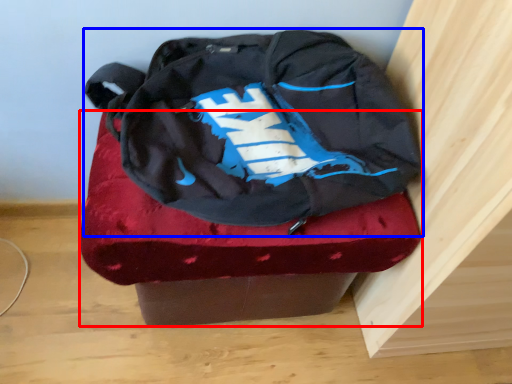
Question: Which point is further to the camera, furniture (highlighted by a red box) or backpack (highlighted by a blue box)?

Choices:
 (A) furniture
 (B) backpack

Answer: (A)